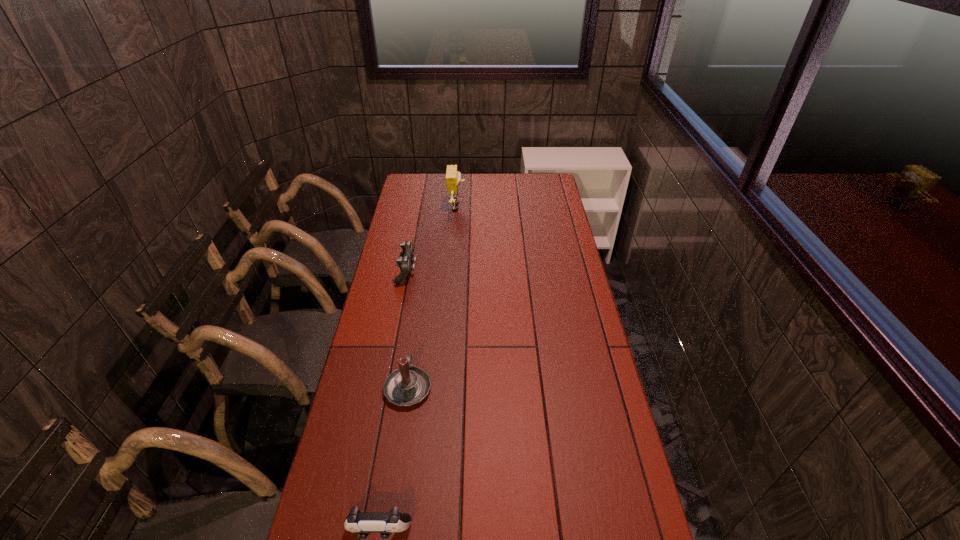
Find the location of a particular element. Image resolution: width=960 pixels, height=540 pixels. vacant area between the farthest object and the third nearest object is located at coordinates (432, 240).

At what (x,y) coordinates should I click in order to perform the action: click on free space between the third shortest object and the tallest object. Please return your answer as a coordinate pair (x, y). Looking at the image, I should click on (433, 297).

The height and width of the screenshot is (540, 960). Find the location of `empty location between the sponge and the second tallest object`. empty location between the sponge and the second tallest object is located at coordinates (433, 297).

The width and height of the screenshot is (960, 540). I want to click on free space between the third shortest object and the farther control, so click(x=408, y=329).

Select which object is the second closest to the tallest object. Please provide its 2D coordinates. Your answer should be formatted as a tuple, i.e. [(x, y)], where the tuple contains the x and y coordinates of a point satisfying the conditions above.

[(409, 385)]

Locate an element on the screen. The image size is (960, 540). object that is the second closest to the tallest object is located at coordinates (409, 385).

I want to click on vacant space that satisfies the following two spatial constraints: 1. on the side of the candle with the handle loop; 2. on the surface of the farther control with buttons, so click(x=425, y=272).

Find the location of a particular element. The width and height of the screenshot is (960, 540). vacant area that satisfies the following two spatial constraints: 1. on the side of the third farthest object with the handle loop; 2. on the surface of the second farthest object with buttons is located at coordinates (425, 272).